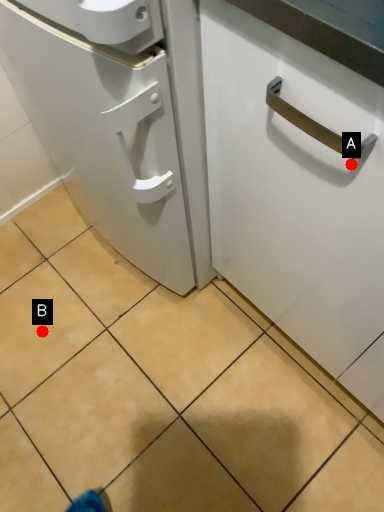
Question: Two points are circled on the image, labeled by A and B beside each circle. Which point is further to the camera?

Choices:
 (A) A is further
 (B) B is further

Answer: (B)